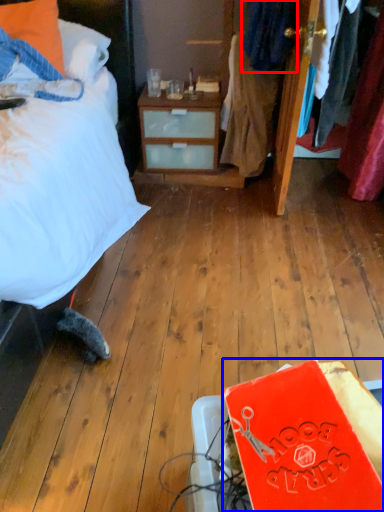
Question: Which of the following is the closest to the observer, clothing (highlighted by a red box) or book (highlighted by a blue box)?

Choices:
 (A) clothing
 (B) book

Answer: (B)